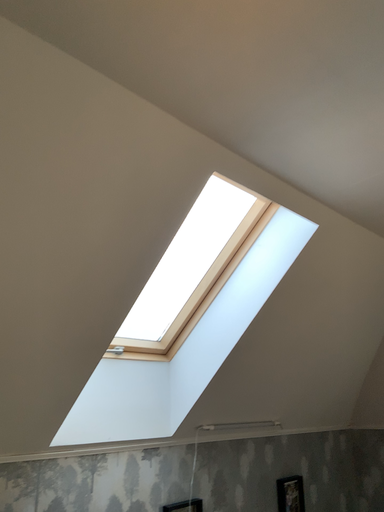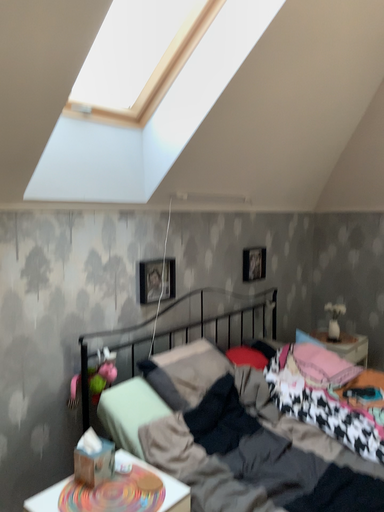
Question: How did the camera likely rotate when shooting the video?

Choices:
 (A) rotated downward
 (B) rotated upward

Answer: (A)